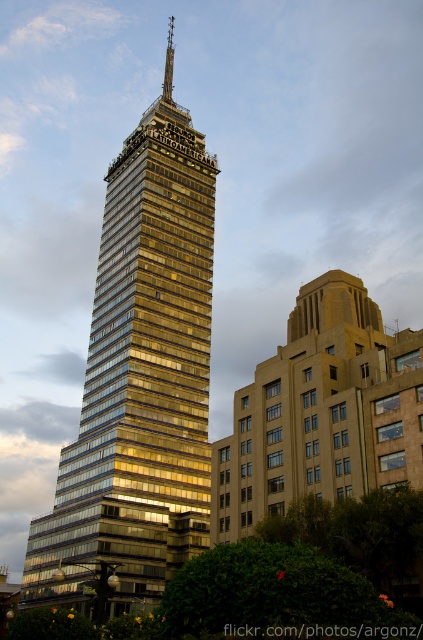
Is gold glassy building at center behind shiny metallic spire at center?

No, it is not.

Which is more to the right, gold glassy building at center or shiny metallic spire at center?

gold glassy building at center is more to the right.

Measure the distance between gold glassy building at center and camera.

gold glassy building at center and camera are 44.73 meters apart.

In order to click on gold glassy building at center in this screenshot , I will do `click(139, 387)`.